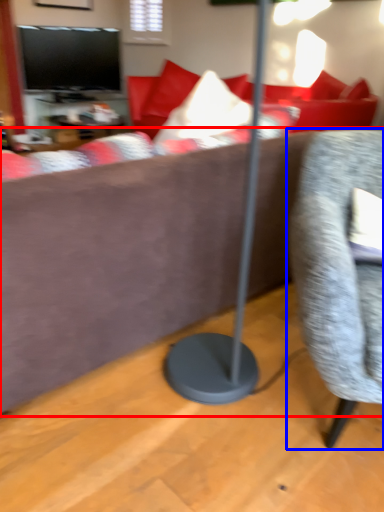
Question: Which of the following is the farthest to the observer, studio couch (highlighted by a red box) or chair (highlighted by a blue box)?

Choices:
 (A) studio couch
 (B) chair

Answer: (A)